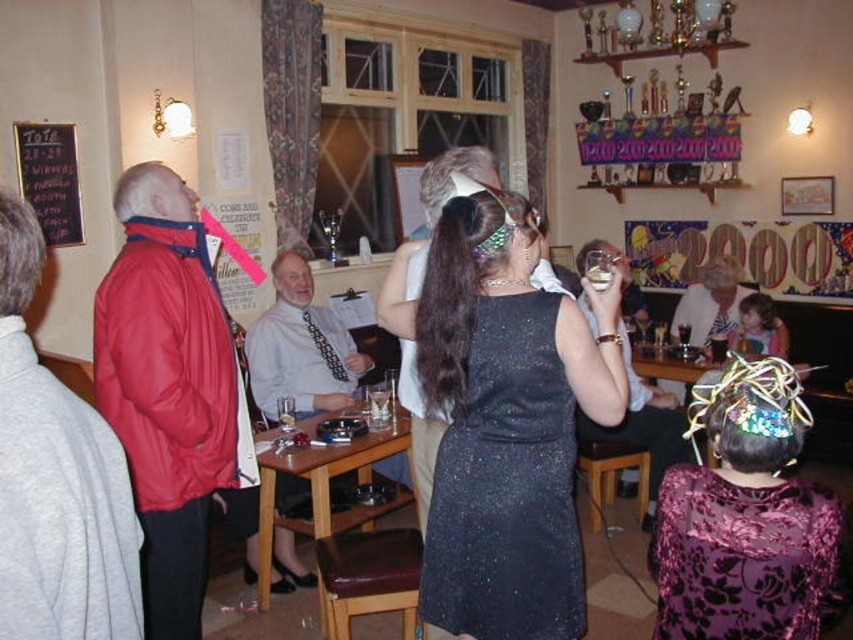
Question: Is leather cushioned stool at lower center to the left of translucent glass at upper center from the viewer's perspective?

Choices:
 (A) yes
 (B) no

Answer: (A)

Question: Which object is farther from the camera taking this photo?

Choices:
 (A) leather cushioned stool at lower center
 (B) brown wooden stool at lower center

Answer: (B)

Question: Which point appears closest to the camera in this image?

Choices:
 (A) (526, 611)
 (B) (45, 138)
 (C) (592, 481)
 (D) (670, 536)

Answer: (A)

Question: Where is leather cushioned stool at lower center located in relation to black chalkboard at upper left in the image?

Choices:
 (A) right
 (B) left

Answer: (A)

Question: Which point appears farthest from the camera in this image?

Choices:
 (A) [x=332, y=614]
 (B) [x=590, y=268]
 (C) [x=30, y=161]
 (D) [x=583, y=598]

Answer: (C)

Question: Considering the relative positions of sparkly purple dress at center and brown wooden stool at lower center in the image provided, where is sparkly purple dress at center located with respect to brown wooden stool at lower center?

Choices:
 (A) left
 (B) right

Answer: (A)